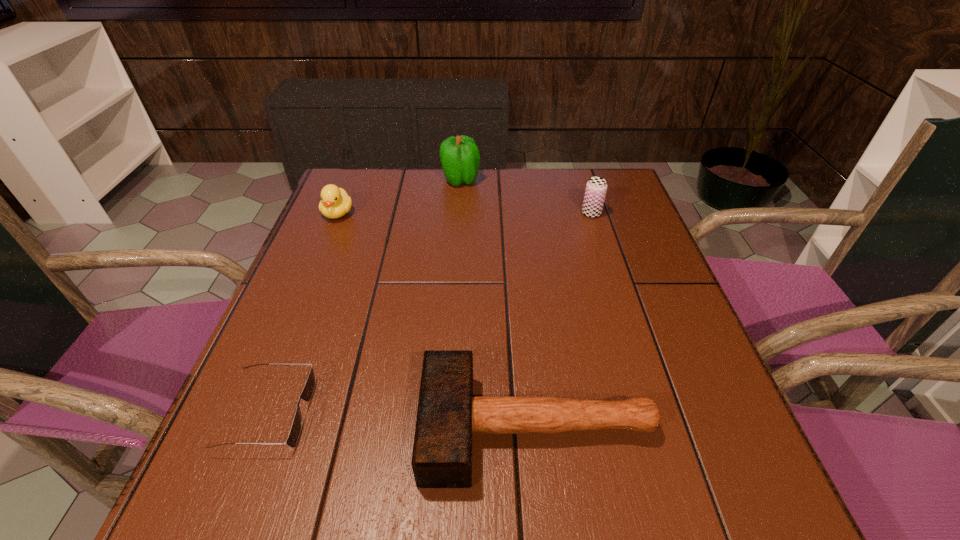
Locate an element on the screen. This screenshot has width=960, height=540. mallet present at the right edge is located at coordinates (448, 414).

Where is `object situated at the far left corner`? The width and height of the screenshot is (960, 540). object situated at the far left corner is located at coordinates (335, 202).

In order to click on object present at the far right corner in this screenshot , I will do `click(596, 187)`.

Identify the location of object present at the near right corner. (448, 414).

In the image, there is a desktop. Identify the location of blank space at the far edge. The height and width of the screenshot is (540, 960). (546, 199).

I want to click on free location at the near edge, so click(543, 501).

In the image, there is a desktop. In order to click on vacant space at the left edge in this screenshot , I will do `click(340, 370)`.

Locate an element on the screen. free region at the right edge of the desktop is located at coordinates (685, 364).

You are a GUI agent. You are given a task and a screenshot of the screen. Output one action in this format:
    pyautogui.click(x=<x>, y=<y>)
    Task: Click on the vacant space at the near left corner of the desktop
    The width and height of the screenshot is (960, 540).
    Given the screenshot: What is the action you would take?
    pyautogui.click(x=220, y=518)

In order to click on empty location between the mallet and the sunglasses in this screenshot , I will do point(402,421).